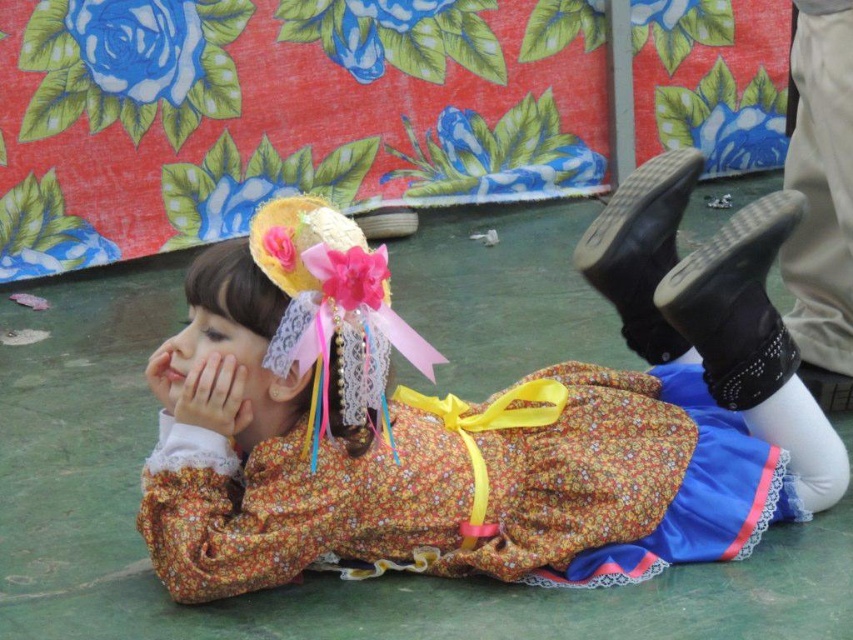
You are a photographer trying to capture a closeup of the smooth skin face at center. However, the floral fabric dress at center is blocking your view. Can you adjust your position to get a clear shot without moving the subject?

The floral fabric dress at center is closer to the viewer than the smooth skin face at center, so adjusting your position to angle the camera around the dress might allow you to capture the smooth skin face at center without obstruction.

You are a photographer standing at the center of the room. You want to take a photo of the floral fabric dress at center. Where should you aim your camera to capture it?

The floral fabric dress at center is located at point 0.653 on the x axis and 0.584 on the y axis, so you should aim your camera towards those coordinates to capture it.